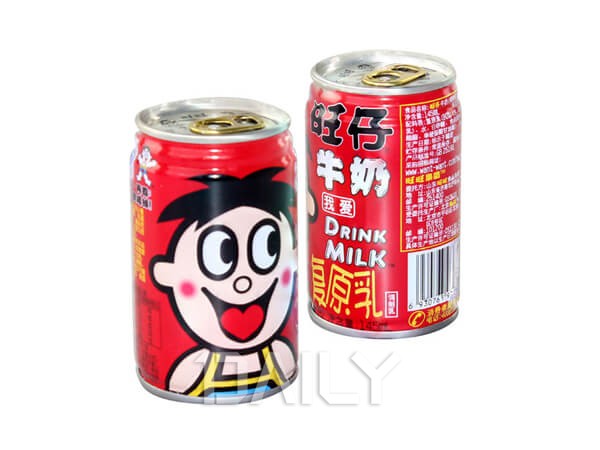
The width and height of the screenshot is (600, 450). I want to click on aluminum top, so click(x=338, y=77).